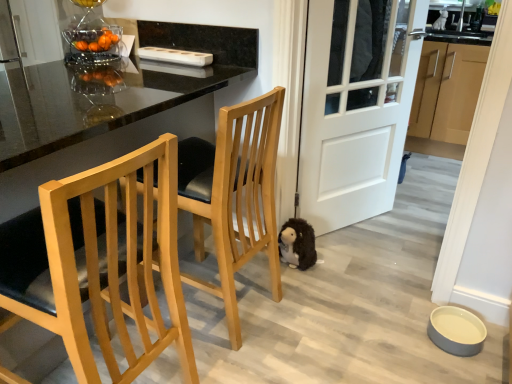
Question: Do you think light brown wood cabinets at right is within light wood/texture chair at left, the second chair from the back, or outside of it?

Choices:
 (A) inside
 (B) outside

Answer: (B)

Question: Relative to light wood/texture chair at left, the 1th chair in the front-to-back sequence, is light brown wood cabinets at right in front or behind?

Choices:
 (A) behind
 (B) front

Answer: (A)

Question: Which is farther from the fuzzy brown stuffed animal at lower center?

Choices:
 (A) light wood/texture chair at left, the second chair from the back
 (B) white matte door at center
 (C) light brown wood cabinets at right
 (D) glossy black table at center
 (E) light wood/black cushioned seat at center, which is the second chair in front-to-back order

Answer: (C)

Question: Considering the real-world distances, which object is closest to the fuzzy brown stuffed animal at lower center?

Choices:
 (A) white matte door at center
 (B) light wood/black cushioned seat at center, which appears as the 1th chair when viewed from the back
 (C) light brown wood cabinets at right
 (D) light wood/texture chair at left, the 1th chair in the front-to-back sequence
 (E) glossy black table at center

Answer: (B)